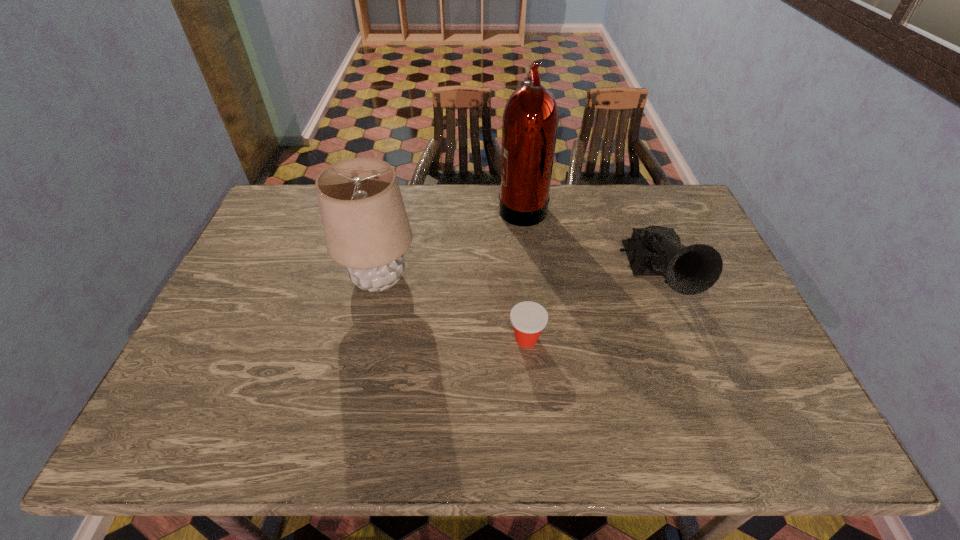
The image size is (960, 540). Find the location of `vacant space at the far left corner`. vacant space at the far left corner is located at coordinates (283, 192).

In the image, there is a desktop. At what (x,y) coordinates should I click in order to perform the action: click on free space at the far right corner. Please return your answer as a coordinate pair (x, y). Looking at the image, I should click on (644, 185).

You are a GUI agent. You are given a task and a screenshot of the screen. Output one action in this format:
    pyautogui.click(x=<x>, y=<y>)
    Task: Click on the vacant area that lies between the farthest object and the leftmost object
    The height and width of the screenshot is (540, 960).
    Given the screenshot: What is the action you would take?
    pyautogui.click(x=450, y=242)

Identify the location of vacant space that's between the Dixie cup and the tallest object. Image resolution: width=960 pixels, height=540 pixels. (524, 272).

At what (x,y) coordinates should I click in order to perform the action: click on vacant point located between the second tallest object and the shortest object. Please return your answer as a coordinate pair (x, y). Looking at the image, I should click on (453, 309).

Where is `empty space between the phonograph_record and the Dixie cup`? This screenshot has height=540, width=960. empty space between the phonograph_record and the Dixie cup is located at coordinates (591, 309).

Where is `free space between the third shortest object and the Dixie cup`? Image resolution: width=960 pixels, height=540 pixels. free space between the third shortest object and the Dixie cup is located at coordinates (453, 309).

Where is `free spot between the leftmost object and the tallest object`? The height and width of the screenshot is (540, 960). free spot between the leftmost object and the tallest object is located at coordinates (450, 242).

This screenshot has height=540, width=960. What are the coordinates of `blank region between the fire extinguisher and the shortest object` in the screenshot? It's located at (524, 272).

Find the location of a particular element. This screenshot has width=960, height=540. free space between the lampshade and the fire extinguisher is located at coordinates (450, 242).